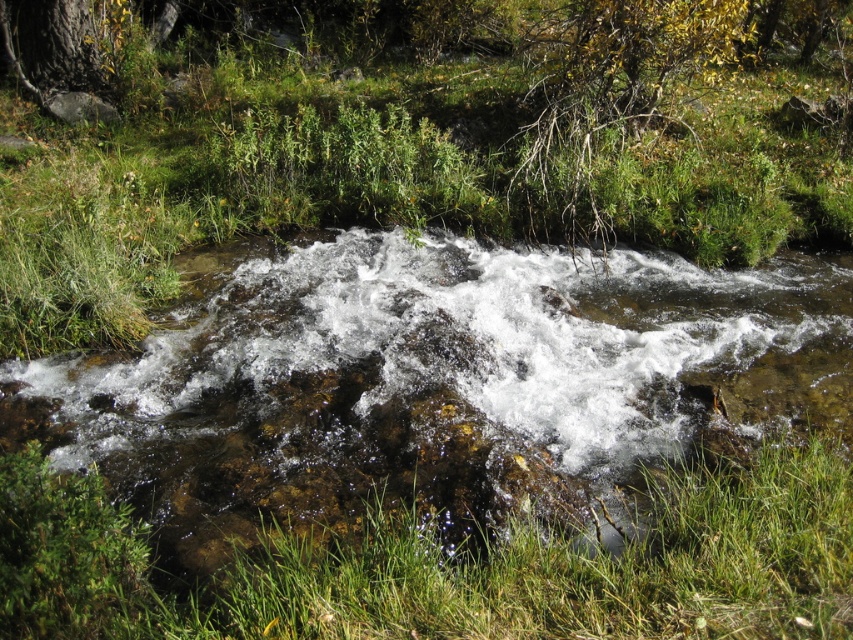
You are a hiker trying to cross the stream. You see clear water at center and green grass at center. Which area has more space to walk on?

The green grass at center occupies more space than the clear water at center, so there is more space to walk on the green grass at center.

You are planning to cross the stream using a wooden plank. The plank is 2 meters long. Based on the scene, will the plank be long enough to safely cross the stream over the clear water at center and green grass at center?

The clear water at center has a larger width than the green grass at center. Since the plank is 2 meters long, it depends on the actual width of the clear water at center. If the clear water at center is wider than 2 meters, the plank may not be long enough. However, without specific measurements, we can only confirm that the clear water at center is wider than the green grass at center.